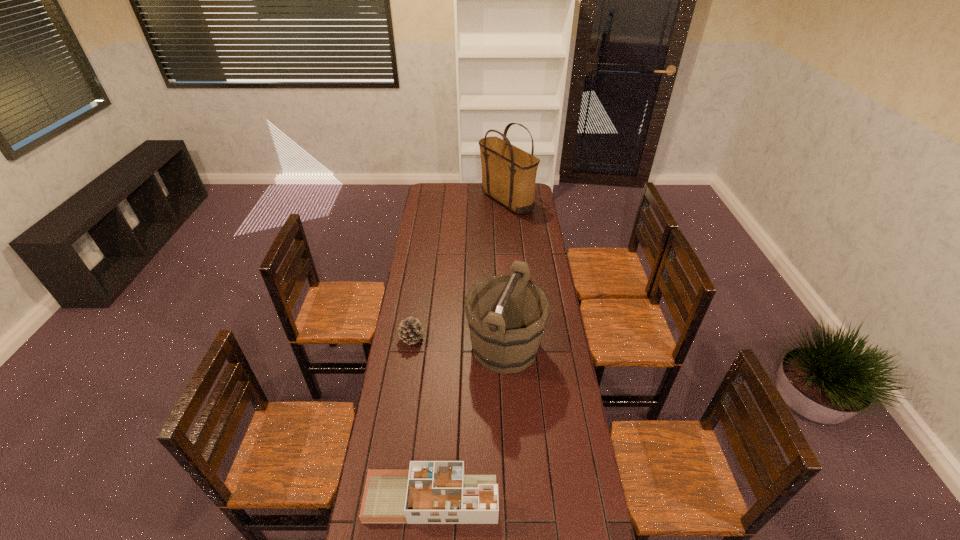
I want to click on free space between the second tallest object and the second shortest object, so click(458, 343).

Image resolution: width=960 pixels, height=540 pixels. In order to click on free point between the shortest object and the third shortest object in this screenshot , I will do `click(468, 423)`.

I want to click on free space between the farthest object and the bucket, so [x=506, y=274].

Locate an element on the screen. object that is the third closest to the shortest object is located at coordinates (508, 173).

Locate an element on the screen. The width and height of the screenshot is (960, 540). object that is the second nearest to the farthest object is located at coordinates (409, 331).

Identify the location of blank space that satisfies the following two spatial constraints: 1. on the front side of the second tallest object; 2. at the front door of the nearest object. This screenshot has height=540, width=960. (514, 498).

Locate an element on the screen. This screenshot has height=540, width=960. vacant area in the image that satisfies the following two spatial constraints: 1. on the front side of the second shortest object; 2. on the left side of the third shortest object is located at coordinates (410, 347).

Where is `vacant point that satisfies the following two spatial constraints: 1. on the front side of the second tallest object; 2. on the left side of the second shortest object`? This screenshot has height=540, width=960. vacant point that satisfies the following two spatial constraints: 1. on the front side of the second tallest object; 2. on the left side of the second shortest object is located at coordinates (410, 347).